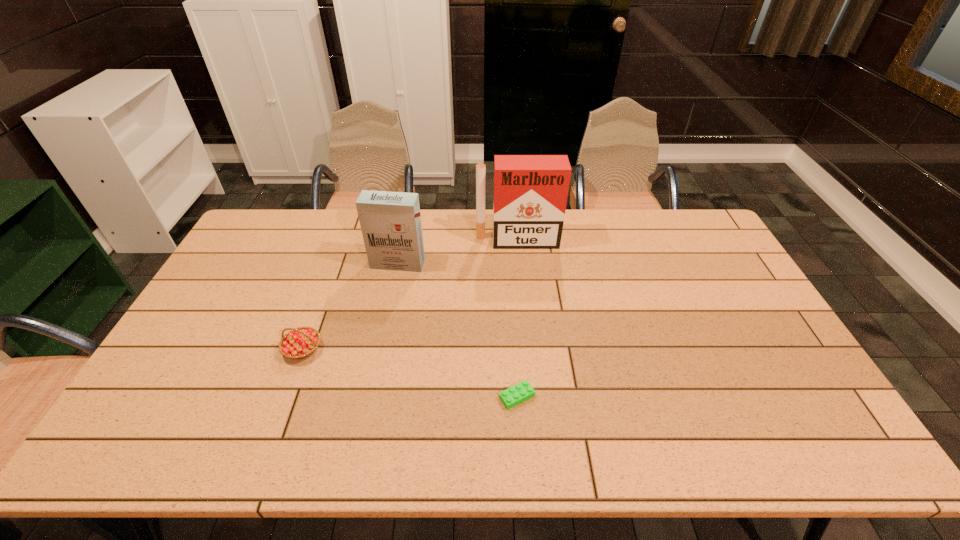
At what (x,y) coordinates should I click in order to perform the action: click on free spot between the shortest object and the left cigarette case. Please return your answer as a coordinate pair (x, y). The height and width of the screenshot is (540, 960). Looking at the image, I should click on (x=457, y=330).

In order to click on free space between the right cigarette case and the left cigarette case in this screenshot , I will do `click(458, 252)`.

At what (x,y) coordinates should I click in order to perform the action: click on free space between the third tallest object and the farthest object. Please return your answer as a coordinate pair (x, y). Looking at the image, I should click on (410, 295).

The width and height of the screenshot is (960, 540). Identify the location of free space between the strawberry and the taller cigarette case. (410, 295).

This screenshot has height=540, width=960. What are the coordinates of `vacant area between the shorter cigarette case and the shortest object` in the screenshot? It's located at (457, 330).

Image resolution: width=960 pixels, height=540 pixels. I want to click on vacant area between the third tallest object and the nearer cigarette case, so click(x=350, y=306).

Find the location of `free space between the shortest object and the farther cigarette case`. free space between the shortest object and the farther cigarette case is located at coordinates (517, 319).

This screenshot has height=540, width=960. I want to click on vacant area between the third nearest object and the right cigarette case, so click(458, 252).

The image size is (960, 540). In order to click on free space between the shortest object and the tallest object in this screenshot , I will do `click(517, 319)`.

You are a GUI agent. You are given a task and a screenshot of the screen. Output one action in this format:
    pyautogui.click(x=<x>, y=<y>)
    Task: Click on the object identified as the closest to the shortest object
    This screenshot has width=960, height=540.
    Given the screenshot: What is the action you would take?
    pyautogui.click(x=299, y=343)